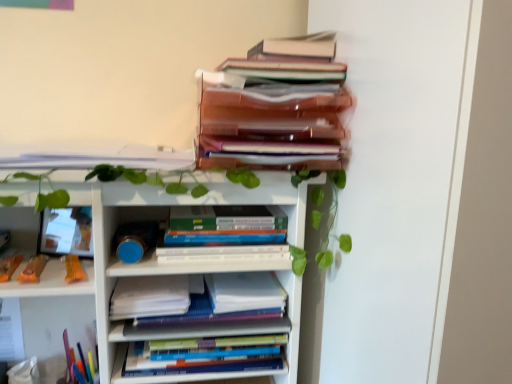
The width and height of the screenshot is (512, 384). Identify the location of white paper at center, the first paperback book viewed from the left. (149, 297).

Where is `hardcover books at center, which ranks as the 5th book in top-to-bottom order`? Image resolution: width=512 pixels, height=384 pixels. hardcover books at center, which ranks as the 5th book in top-to-bottom order is located at coordinates (202, 360).

How much space does white paper at center, which appears as the 1th paperback book when viewed from the right, occupy vertically?

white paper at center, which appears as the 1th paperback book when viewed from the right, is 1.76 inches tall.

Consider the image. In order to face white paper at center, which appears as the 1th paperback book when viewed from the right, should I rotate leftwards or rightwards?

Turn left by 1.417 degrees to look at white paper at center, which appears as the 1th paperback book when viewed from the right.

In order to face white matte bookcase at upper center, should I rotate leftwards or rightwards?

Turn left by 10.915 degrees to look at white matte bookcase at upper center.

Describe the element at coordinates (276, 105) in the screenshot. I see `translucent plastic folders at upper center, which is counted as the first book, starting from the top` at that location.

Image resolution: width=512 pixels, height=384 pixels. What are the coordinates of `white paper at upper left, arranged as the fourth book when ordered from the bottom` in the screenshot? It's located at (94, 156).

Is white paper at center, the second paperback book in the right-to-left sequence, inside the boundaries of hardcover books at center, positioned as the 3th book in bottom-to-top order, or outside?

The correct answer is: outside.

Is point (114, 300) behind point (261, 211)?

No, it is not.

Is white paper at center, the first paperback book viewed from the left, not near hardcover books at center, the 3th book in the top-to-bottom sequence?

No.

Is white paper at center, the second paperback book in the right-to-left sequence, facing away from hardcover books at center, the 3th book in the top-to-bottom sequence?

That's not correct — white paper at center, the second paperback book in the right-to-left sequence, is not looking away from hardcover books at center, the 3th book in the top-to-bottom sequence.

Is white paper at upper left, which ranks as the 2th book in top-to-bottom order, completely or partially inside white paper at center, the fourth book from the top?

That's incorrect, white paper at upper left, which ranks as the 2th book in top-to-bottom order, is not inside white paper at center, the fourth book from the top.

Considering the relative sizes of white paper at center, arranged as the second book when ordered from the bottom, and white paper at upper left, arranged as the fourth book when ordered from the bottom, in the image provided, is white paper at center, arranged as the second book when ordered from the bottom, thinner than white paper at upper left, arranged as the fourth book when ordered from the bottom,?

Yes.

Is white paper at center, arranged as the second book when ordered from the bottom, looking in the opposite direction of white paper at upper left, arranged as the fourth book when ordered from the bottom?

No, white paper at center, arranged as the second book when ordered from the bottom,'s orientation is not away from white paper at upper left, arranged as the fourth book when ordered from the bottom.

Does white paper at center, arranged as the second book when ordered from the bottom, have a larger size compared to white paper at upper left, arranged as the fourth book when ordered from the bottom?

No.

Between white paper at center, arranged as the second book when ordered from the bottom, and white matte bookcase at upper center, which one has smaller width?

white matte bookcase at upper center is thinner.

Is white paper at center, arranged as the second book when ordered from the bottom, in contact with white matte bookcase at upper center?

white paper at center, arranged as the second book when ordered from the bottom, and white matte bookcase at upper center are not in contact.

How distant is white paper at center, the fourth book from the top, from white matte bookcase at upper center?

A distance of 5.32 inches exists between white paper at center, the fourth book from the top, and white matte bookcase at upper center.

Is white matte bookcase at upper center at the back of white paper at center, the fourth book from the top?

No, white matte bookcase at upper center is not at the back of white paper at center, the fourth book from the top.

Is white paper at center, the second paperback book in the right-to-left sequence, positioned beyond the bounds of hardcover books at center, which ranks as the 5th book in top-to-bottom order?

Yes, white paper at center, the second paperback book in the right-to-left sequence, is located beyond the bounds of hardcover books at center, which ranks as the 5th book in top-to-bottom order.

Is hardcover books at center, which ranks as the 5th book in top-to-bottom order, at the back of white paper at center, the second paperback book in the right-to-left sequence?

No, white paper at center, the second paperback book in the right-to-left sequence, is not facing away from hardcover books at center, which ranks as the 5th book in top-to-bottom order.

Based on their sizes in the image, would you say white paper at center, the second paperback book in the right-to-left sequence, is bigger or smaller than hardcover books at center, which appears as the first book when ordered from the bottom?

In the image, white paper at center, the second paperback book in the right-to-left sequence, appears to be smaller than hardcover books at center, which appears as the first book when ordered from the bottom.

Identify the location of paperback book that is the 2nd one above the hardcover books at center, which ranks as the 5th book in top-to-bottom order (from a real-world perspective). The width and height of the screenshot is (512, 384). (149, 297).

Does point (136, 324) come closer to viewer compared to point (141, 348)?

That is True.

Is white paper at center, arranged as the second book when ordered from the bottom, positioned with its back to hardcover books at center, which ranks as the 5th book in top-to-bottom order?

No, white paper at center, arranged as the second book when ordered from the bottom,'s orientation is not away from hardcover books at center, which ranks as the 5th book in top-to-bottom order.

Would you say white paper at center, the fourth book from the top, is a long distance from hardcover books at center, which appears as the first book when ordered from the bottom?

white paper at center, the fourth book from the top, is actually quite close to hardcover books at center, which appears as the first book when ordered from the bottom.

Considering the relative positions of white paper at center, the fourth book from the top, and hardcover books at center, the 3th book in the top-to-bottom sequence, in the image provided, is white paper at center, the fourth book from the top, to the left or to the right of hardcover books at center, the 3th book in the top-to-bottom sequence,?

In the image, white paper at center, the fourth book from the top, appears on the left side of hardcover books at center, the 3th book in the top-to-bottom sequence.

Do you think white paper at center, arranged as the second book when ordered from the bottom, is within hardcover books at center, the 3th book in the top-to-bottom sequence, or outside of it?

The correct answer is: outside.

Considering the points (233, 318) and (214, 215), which point is in front, point (233, 318) or point (214, 215)?

The point (233, 318) is closer to the camera.

Is white paper at center, which ranks as the second paperback book in left-to-right order, located within white matte bookcase at upper center?

No.

Where is `paperback book that is the 2nd one when counting backward from the white matte bookcase at upper center`? The width and height of the screenshot is (512, 384). paperback book that is the 2nd one when counting backward from the white matte bookcase at upper center is located at coordinates (244, 291).

Considering the sizes of objects white matte bookcase at upper center and white paper at center, which ranks as the second paperback book in left-to-right order, in the image provided, who is shorter, white matte bookcase at upper center or white paper at center, which ranks as the second paperback book in left-to-right order,?

With less height is white paper at center, which ranks as the second paperback book in left-to-right order.

What are the coordinates of `paperback book that is in front of the hardcover books at center, the 3th book in the top-to-bottom sequence` in the screenshot? It's located at (149, 297).

Find the location of a particular element. the 2nd book counting from the right side of the white paper at upper left, which ranks as the 2th book in top-to-bottom order is located at coordinates (183, 331).

Which object lies further to the anchor point white paper at upper left, arranged as the fourth book when ordered from the bottom, hardcover books at center, which ranks as the 5th book in top-to-bottom order, or translucent plastic folders at upper center, marked as the 5th book in a bottom-to-top arrangement?

hardcover books at center, which ranks as the 5th book in top-to-bottom order, lies further to white paper at upper left, arranged as the fourth book when ordered from the bottom, than the other object.

Estimate the real-world distances between objects in this image. Which object is further from white paper at center, arranged as the second book when ordered from the bottom, hardcover books at center, which ranks as the 5th book in top-to-bottom order, or white matte bookcase at upper center?

white matte bookcase at upper center lies further to white paper at center, arranged as the second book when ordered from the bottom, than the other object.

Looking at the image, which one is located closer to white paper at center, which appears as the 1th paperback book when viewed from the right, hardcover books at center, the 3th book in the top-to-bottom sequence, or white paper at center, arranged as the second book when ordered from the bottom?

Based on the image, white paper at center, arranged as the second book when ordered from the bottom, appears to be nearer to white paper at center, which appears as the 1th paperback book when viewed from the right.

Estimate the real-world distances between objects in this image. Which object is closer to white paper at upper left, arranged as the fourth book when ordered from the bottom, white matte bookcase at upper center or hardcover books at center, the 3th book in the top-to-bottom sequence?

white matte bookcase at upper center lies closer to white paper at upper left, arranged as the fourth book when ordered from the bottom, than the other object.

Based on their spatial positions, is hardcover books at center, the 3th book in the top-to-bottom sequence, or white paper at center, which ranks as the second paperback book in left-to-right order, further from translucent plastic folders at upper center, which is counted as the first book, starting from the top?

white paper at center, which ranks as the second paperback book in left-to-right order, is positioned further to the anchor translucent plastic folders at upper center, which is counted as the first book, starting from the top.

Based on their spatial positions, is white paper at center, arranged as the second book when ordered from the bottom, or white matte bookcase at upper center closer to hardcover books at center, which ranks as the 5th book in top-to-bottom order?

white paper at center, arranged as the second book when ordered from the bottom, lies closer to hardcover books at center, which ranks as the 5th book in top-to-bottom order, than the other object.

From the image, which object appears to be nearer to white paper at center, arranged as the second book when ordered from the bottom, white paper at center, which ranks as the second paperback book in left-to-right order, or hardcover books at center, which appears as the first book when ordered from the bottom?

The object closer to white paper at center, arranged as the second book when ordered from the bottom, is hardcover books at center, which appears as the first book when ordered from the bottom.

Consider the image. Based on their spatial positions, is white paper at center, which appears as the 1th paperback book when viewed from the right, or hardcover books at center, the 3th book in the top-to-bottom sequence, closer to white paper at center, the fourth book from the top?

Based on the image, white paper at center, which appears as the 1th paperback book when viewed from the right, appears to be nearer to white paper at center, the fourth book from the top.

This screenshot has height=384, width=512. In order to click on bookcase that lies between white paper at upper left, arranged as the fourth book when ordered from the bottom, and white paper at center, the fourth book from the top, from top to bottom in this screenshot , I will do `click(157, 273)`.

This screenshot has width=512, height=384. I want to click on paperback book between white paper at upper left, arranged as the fourth book when ordered from the bottom, and white paper at center, the second paperback book in the right-to-left sequence, in the up-down direction, so click(244, 291).

I want to click on bookcase located between white paper at upper left, arranged as the fourth book when ordered from the bottom, and hardcover books at center, the 3th book in the top-to-bottom sequence, in the left-right direction, so click(157, 273).

Locate an element on the screen. This screenshot has height=384, width=512. bookcase between translucent plastic folders at upper center, marked as the 5th book in a bottom-to-top arrangement, and white paper at center, which ranks as the second paperback book in left-to-right order, vertically is located at coordinates (157, 273).